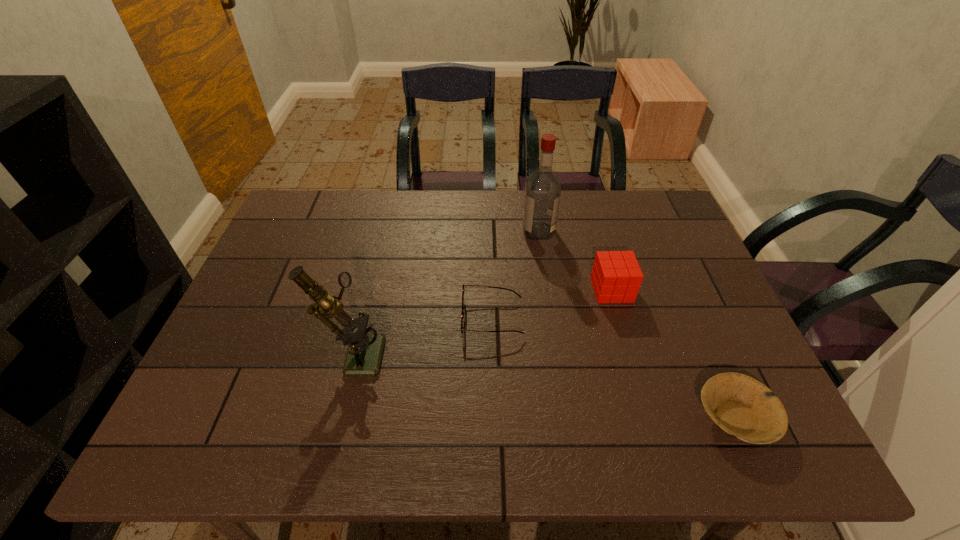
Where is `object located in the near right corner section of the desktop`? The width and height of the screenshot is (960, 540). object located in the near right corner section of the desktop is located at coordinates (742, 406).

What are the coordinates of `blank space at the far edge of the desktop` in the screenshot? It's located at (396, 203).

This screenshot has height=540, width=960. In the image, there is a desktop. In order to click on vacant space at the near edge in this screenshot , I will do `click(451, 440)`.

You are a GUI agent. You are given a task and a screenshot of the screen. Output one action in this format:
    pyautogui.click(x=<x>, y=<y>)
    Task: Click on the free space at the left edge
    
    Given the screenshot: What is the action you would take?
    pyautogui.click(x=249, y=409)

In the image, there is a desktop. Where is `free space at the right edge`? The image size is (960, 540). free space at the right edge is located at coordinates (753, 370).

Find the location of a particular element. vacant position at the far right corner of the desktop is located at coordinates (650, 199).

At what (x,y) coordinates should I click in order to perform the action: click on free point between the third object from left to right and the leftmost object. Please return your answer as a coordinate pair (x, y). This screenshot has width=960, height=540. Looking at the image, I should click on (446, 292).

This screenshot has height=540, width=960. I want to click on free space between the cube and the leftmost object, so click(483, 321).

The height and width of the screenshot is (540, 960). I want to click on vacant area between the spectacles and the microscope, so click(x=423, y=335).

The width and height of the screenshot is (960, 540). Identify the location of vacant area that lies between the microscope and the second object from left to right. (423, 335).